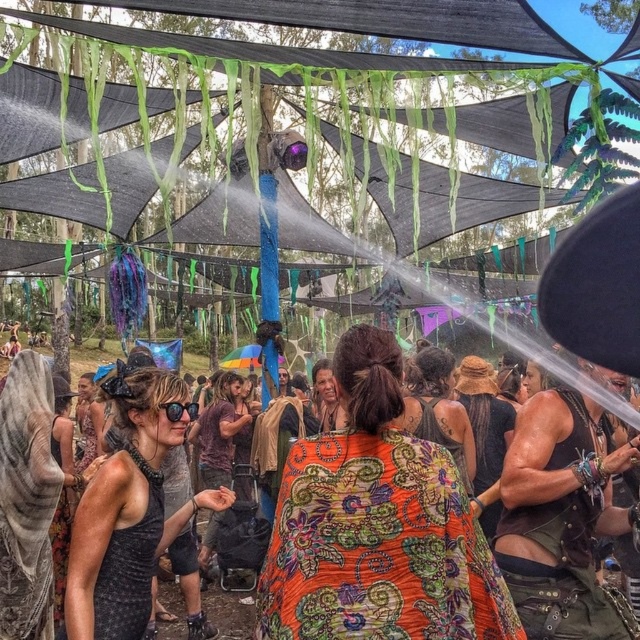
Question: Which of the following is the farthest from the observer?

Choices:
 (A) black mesh tank top at center
 (B) leather vest at center
 (C) orange floral fabric at center

Answer: (A)

Question: Can you confirm if leather vest at center is positioned to the right of black mesh tank top at center?

Choices:
 (A) yes
 (B) no

Answer: (A)

Question: Does orange floral fabric at center appear on the right side of leather vest at center?

Choices:
 (A) yes
 (B) no

Answer: (B)

Question: Does orange floral fabric at center have a smaller size compared to leather vest at center?

Choices:
 (A) no
 (B) yes

Answer: (B)

Question: Which object is positioned farthest from the leather vest at center?

Choices:
 (A) black mesh tank top at center
 (B) orange floral fabric at center

Answer: (A)

Question: Which point is closer to the camera taking this photo?

Choices:
 (A) (497, 532)
 (B) (605, 636)
 (C) (136, 614)

Answer: (B)